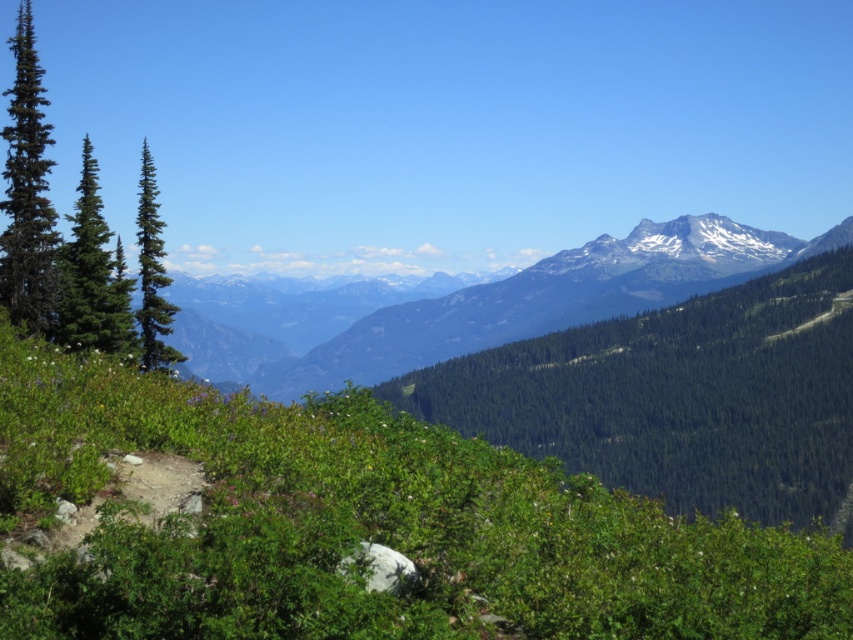
You are standing on the dirt path and want to take a photo of both the green matte evergreen tree at left and the green matte tree at left. Which tree should you position yourself closer to in order to capture both in the same frame?

To capture both the green matte evergreen tree at left and the green matte tree at left in the same frame, you should position yourself closer to the green matte evergreen tree at left since it is positioned to the left of the green matte tree at left, allowing both to be included within the camera view.

In the scene shown: You are standing at the point closer to the camera in this mountain landscape. Which point are you at, point [621,356] or point [143,282]?

You are at point [143,282] because it is closer to the camera than point [621,356].

You are a hiker planning to take a photo of both the green matte evergreen tree at left and the green matte tree at left. Since you want both trees to be clearly visible in the photo, which tree should you focus on first to ensure it is in focus?

The green matte evergreen tree at left is smaller than the green matte tree at left, so you should focus on the green matte tree at left first to ensure it is in focus.